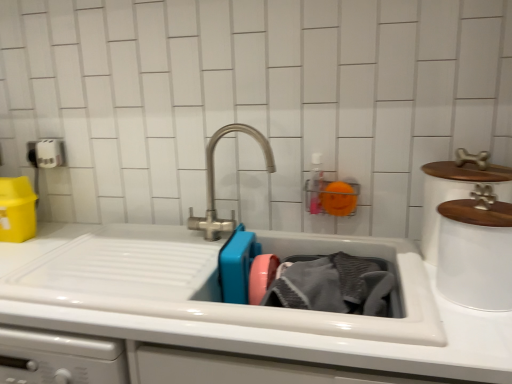
Question: Is white glossy sink at center aimed at white ceramic container at upper right, the second appliance when ordered from front to back?

Choices:
 (A) no
 (B) yes

Answer: (A)

Question: From the image's perspective, is white glossy sink at center under white ceramic container at upper right, the 1th appliance from the back?

Choices:
 (A) yes
 (B) no

Answer: (A)

Question: Is the position of white glossy sink at center more distant than that of white ceramic container at upper right, the 1th appliance from the back?

Choices:
 (A) yes
 (B) no

Answer: (B)

Question: Are white glossy sink at center and white ceramic container at upper right, the 1th appliance from the back, making contact?

Choices:
 (A) yes
 (B) no

Answer: (B)

Question: Is white glossy sink at center at the left side of white ceramic container at upper right, the second appliance when ordered from front to back?

Choices:
 (A) yes
 (B) no

Answer: (A)

Question: Does white glossy sink at center contain white ceramic container at upper right, the 1th appliance from the back?

Choices:
 (A) yes
 (B) no

Answer: (B)

Question: From a real-world perspective, is white matte pet food container at upper right, which ranks as the second appliance in back-to-front order, under gray textured towel at sink?

Choices:
 (A) no
 (B) yes

Answer: (A)

Question: Does white matte pet food container at upper right, which ranks as the second appliance in back-to-front order, lie behind gray textured towel at sink?

Choices:
 (A) no
 (B) yes

Answer: (A)

Question: Considering the relative positions of white matte pet food container at upper right, which is counted as the 1th appliance, starting from the front, and gray textured towel at sink in the image provided, is white matte pet food container at upper right, which is counted as the 1th appliance, starting from the front, in front of gray textured towel at sink?

Choices:
 (A) yes
 (B) no

Answer: (A)

Question: Does white matte pet food container at upper right, which is counted as the 1th appliance, starting from the front, have a lesser width compared to gray textured towel at sink?

Choices:
 (A) no
 (B) yes

Answer: (B)

Question: Would you say white matte pet food container at upper right, which ranks as the second appliance in back-to-front order, is outside gray textured towel at sink?

Choices:
 (A) no
 (B) yes

Answer: (B)

Question: From the image's perspective, is white matte pet food container at upper right, which is counted as the 1th appliance, starting from the front, located beneath gray textured towel at sink?

Choices:
 (A) yes
 (B) no

Answer: (B)

Question: Does gray textured towel at sink have a lesser width compared to white matte toilet paper at upper left?

Choices:
 (A) no
 (B) yes

Answer: (A)